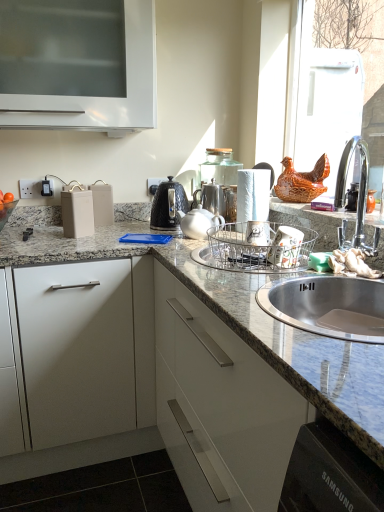
The image size is (384, 512). I want to click on white glossy refrigerator at upper right, the first appliance viewed from the right, so click(331, 109).

Describe the element at coordinates (153, 387) in the screenshot. I see `granite at center` at that location.

You are a GUI agent. You are given a task and a screenshot of the screen. Output one action in this format:
    pyautogui.click(x=<x>, y=<y>)
    Task: Click on the matte white battery at left, acting as the first appliance starting from the left
    
    Given the screenshot: What is the action you would take?
    [77, 213]

Describe the element at coordinates (77, 213) in the screenshot. I see `matte white battery at left, acting as the first appliance starting from the left` at that location.

At what (x,y) coordinates should I click in order to perform the action: click on white matte drawer at left. Please return your answer as a coordinate pair (x, y). The width and height of the screenshot is (384, 512). Looking at the image, I should click on (77, 350).

You are a GUI agent. You are given a task and a screenshot of the screen. Output one action in this format:
    pyautogui.click(x=<x>, y=<y>)
    Task: Click on the white glossy refrigerator at upper right, the first appliance viewed from the right
    This screenshot has height=512, width=384.
    Given the screenshot: What is the action you would take?
    pyautogui.click(x=331, y=109)

Considering the relative positions of black plastic electric outlet at center, the 2th electric outlet from the left, and white matte drawer at left in the image provided, is black plastic electric outlet at center, the 2th electric outlet from the left, to the right of white matte drawer at left from the viewer's perspective?

Yes, black plastic electric outlet at center, the 2th electric outlet from the left, is to the right of white matte drawer at left.

Which is nearer, (x=149, y=184) or (x=114, y=372)?

The point (x=114, y=372) is closer.

From a real-world perspective, relative to white matte drawer at left, is black plastic electric outlet at center, the 2th electric outlet from the left, vertically above or below?

black plastic electric outlet at center, the 2th electric outlet from the left, is above white matte drawer at left.

Considering the relative sizes of black plastic electric outlet at center, acting as the first electric outlet starting from the back, and granite at center in the image provided, is black plastic electric outlet at center, acting as the first electric outlet starting from the back, shorter than granite at center?

Yes.

Which is closer, (157, 181) or (326, 385)?

Point (157, 181) is farther from the camera than point (326, 385).

Considering the relative sizes of black plastic electric outlet at center, acting as the first electric outlet starting from the back, and granite at center in the image provided, is black plastic electric outlet at center, acting as the first electric outlet starting from the back, bigger than granite at center?

Incorrect, black plastic electric outlet at center, acting as the first electric outlet starting from the back, is not larger than granite at center.

Consider the image. Can you tell me how much white glossy teapot at center and matte ceramic mugs at center, which appears as the 2th appliance when viewed from the right, differ in facing direction?

The angle between the facing direction of white glossy teapot at center and the facing direction of matte ceramic mugs at center, which appears as the 2th appliance when viewed from the right, is 0.634 degrees.

Between white glossy teapot at center and matte ceramic mugs at center, which is the 3th appliance from left to right, which one has smaller width?

With smaller width is matte ceramic mugs at center, which is the 3th appliance from left to right.

Which point is more forward, (x=201, y=215) or (x=285, y=254)?

The point (x=285, y=254) is closer to the camera.

Does white glossy teapot at center appear on the left side of matte ceramic mugs at center, which appears as the 2th appliance when viewed from the right?

Correct, you'll find white glossy teapot at center to the left of matte ceramic mugs at center, which appears as the 2th appliance when viewed from the right.

Which is further, (153, 193) or (269, 258)?

Positioned behind is point (153, 193).

In the scene shown: Can you confirm if black plastic electric outlet at center, the 2th electric outlet from the left, is wider than matte ceramic mugs at center, which is the 3th appliance from left to right?

Incorrect, the width of black plastic electric outlet at center, the 2th electric outlet from the left, does not surpass that of matte ceramic mugs at center, which is the 3th appliance from left to right.

Is black plastic electric outlet at center, the 2th electric outlet from the left, touching shiny stainless steel sink at right?

No, black plastic electric outlet at center, the 2th electric outlet from the left, is not with shiny stainless steel sink at right.

From the picture: From the image's perspective, is black plastic electric outlet at center, positioned as the 2th electric outlet in front-to-back order, above or below shiny stainless steel sink at right?

Based on their image positions, black plastic electric outlet at center, positioned as the 2th electric outlet in front-to-back order, is located above shiny stainless steel sink at right.

Find the location of a particular element. This screenshot has width=384, height=512. sink located on the right of black plastic electric outlet at center, positioned as the 2th electric outlet in front-to-back order is located at coordinates (329, 307).

From the image's perspective, which is below, white glossy teapot at center or black plastic electric outlet at center, acting as the first electric outlet starting from the back?

white glossy teapot at center is shown below in the image.

Is white glossy teapot at center looking in the opposite direction of black plastic electric outlet at center, the 2th electric outlet from the left?

No, black plastic electric outlet at center, the 2th electric outlet from the left, is not at the back of white glossy teapot at center.

Can you tell me how much white glossy teapot at center and black plastic electric outlet at center, the 2th electric outlet from the left, differ in facing direction?

They differ by 89.4 degrees in their facing directions.

From the image's perspective, which one is positioned lower, metallic silver dish rack at sink, which is the second appliance from left to right, or white plastic electric outlet at left, the 2th electric outlet viewed from the right?

metallic silver dish rack at sink, which is the second appliance from left to right, from the image's perspective.

How distant is metallic silver dish rack at sink, which is the second appliance from left to right, from white plastic electric outlet at left, the 2th electric outlet viewed from the right?

A distance of 3.40 feet exists between metallic silver dish rack at sink, which is the second appliance from left to right, and white plastic electric outlet at left, the 2th electric outlet viewed from the right.

Considering the sizes of metallic silver dish rack at sink, which is counted as the 3th appliance, starting from the right, and white plastic electric outlet at left, the first electric outlet positioned from the front, in the image, is metallic silver dish rack at sink, which is counted as the 3th appliance, starting from the right, bigger or smaller than white plastic electric outlet at left, the first electric outlet positioned from the front,?

metallic silver dish rack at sink, which is counted as the 3th appliance, starting from the right, is bigger than white plastic electric outlet at left, the first electric outlet positioned from the front.

Which object is further away from the camera, metallic silver dish rack at sink, which is counted as the 3th appliance, starting from the right, or white plastic electric outlet at left, the 2th electric outlet viewed from the right?

white plastic electric outlet at left, the 2th electric outlet viewed from the right, is further away from the camera.

Locate an element on the screen. The height and width of the screenshot is (512, 384). the 2nd electric outlet behind the white matte drawer at left is located at coordinates (154, 185).

From a real-world perspective, which electric outlet is the 1st one above the granite at center? Please provide its 2D coordinates.

[(154, 185)]

Based on their spatial positions, is shiny stainless steel sink at right or black plastic electric outlet at center, which appears as the first electric outlet when viewed from the right, further from metallic silver dish rack at sink, which is the second appliance from left to right?

black plastic electric outlet at center, which appears as the first electric outlet when viewed from the right, lies further to metallic silver dish rack at sink, which is the second appliance from left to right, than the other object.

Considering their positions, is black plastic electric outlet at center, positioned as the 2th electric outlet in front-to-back order, positioned further to shiny stainless steel sink at right than white glossy teapot at center?

Based on the image, black plastic electric outlet at center, positioned as the 2th electric outlet in front-to-back order, appears to be further to shiny stainless steel sink at right.

From the image, which object appears to be nearer to black textured kettle at center, acting as the 1th coffeepot starting from the left, satin silver coffee pot at center, the 1th coffeepot viewed from the right, or white glossy cabinet at upper left?

Among the two, satin silver coffee pot at center, the 1th coffeepot viewed from the right, is located nearer to black textured kettle at center, acting as the 1th coffeepot starting from the left.

From the image, which object appears to be nearer to white glossy teapot at center, granite at center or black plastic electric outlet at center, which appears as the first electric outlet when viewed from the right?

Among the two, black plastic electric outlet at center, which appears as the first electric outlet when viewed from the right, is located nearer to white glossy teapot at center.

Estimate the real-world distances between objects in this image. Which object is further from black plastic electric outlet at center, acting as the first electric outlet starting from the back, white matte paper towel at center or white glossy cabinet at upper left?

Based on the image, white glossy cabinet at upper left appears to be further to black plastic electric outlet at center, acting as the first electric outlet starting from the back.

When comparing their distances from white plastic electric outlet at left, the 2th electric outlet viewed from the right, does granite at center or matte white battery at left, which is the 4th appliance in right-to-left order, seem closer?

matte white battery at left, which is the 4th appliance in right-to-left order, is closer to white plastic electric outlet at left, the 2th electric outlet viewed from the right.

Considering their positions, is white glossy teapot at center positioned further to matte white battery at left, acting as the first appliance starting from the left, than white glossy refrigerator at upper right, the fourth appliance when ordered from left to right?

white glossy refrigerator at upper right, the fourth appliance when ordered from left to right.

Which object lies nearer to the anchor point granite at center, black textured kettle at center, acting as the 1th coffeepot starting from the left, or white glossy teapot at center?

white glossy teapot at center is positioned closer to the anchor granite at center.

I want to click on sink between granite at center and satin silver coffee pot at center, the 2th coffeepot when ordered from left to right, from front to back, so click(329, 307).

The height and width of the screenshot is (512, 384). I want to click on tea pot between white glossy cabinet at upper left and matte ceramic mugs at center, which is the 3th appliance from left to right, vertically, so click(199, 222).

Locate an element on the screen. Image resolution: width=384 pixels, height=512 pixels. paper towel between white glossy teapot at center and black plastic electric outlet at center, which appears as the first electric outlet when viewed from the right, in the front-back direction is located at coordinates (252, 196).

What are the coordinates of `appliance between white glossy teapot at center and black plastic electric outlet at center, positioned as the 2th electric outlet in front-to-back order, in the front-back direction` in the screenshot? It's located at (77, 213).